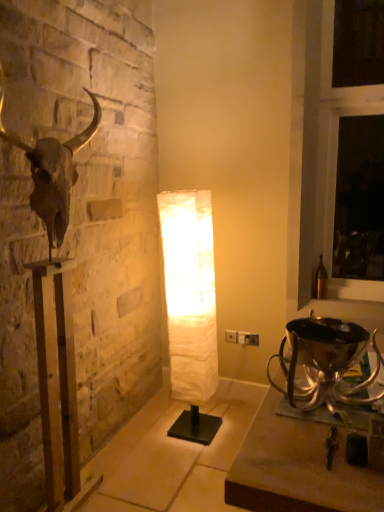
Image resolution: width=384 pixels, height=512 pixels. I want to click on free location to the right of white paper lamp at center, so point(230,426).